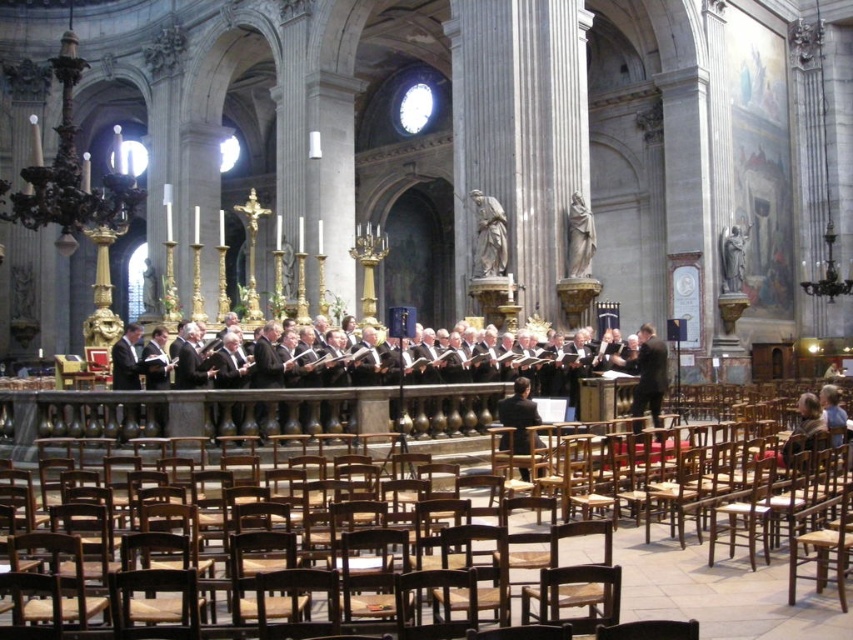
Question: Which point is closer to the camera?

Choices:
 (A) white marble statue at center-right
 (B) wooden chair at center

Answer: (B)

Question: Which of the following is the farthest from the observer?

Choices:
 (A) white marble statue at center-right
 (B) white marble statue at center

Answer: (A)

Question: Can you confirm if black glossy suit at center is wider than black suit at right?

Choices:
 (A) yes
 (B) no

Answer: (A)

Question: Can you confirm if black suit at center is wider than white marble statue at center-right?

Choices:
 (A) yes
 (B) no

Answer: (B)

Question: Is black glossy suit at center smaller than white marble statue at center-right?

Choices:
 (A) yes
 (B) no

Answer: (B)

Question: Which object is the closest to the wooden chair at center?

Choices:
 (A) black glossy suit at center
 (B) white marble statue at center-right
 (C) black suit at right
 (D) black suit at center

Answer: (A)